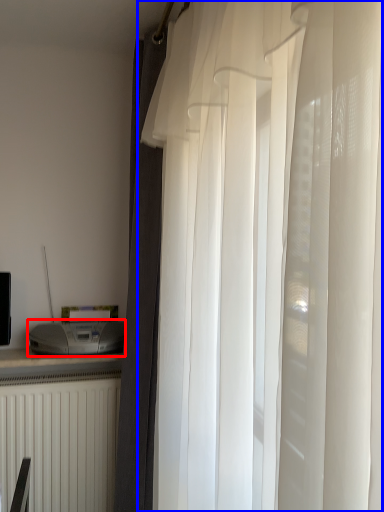
Question: Which point is further to the camera, appliance (highlighted by a red box) or curtain (highlighted by a blue box)?

Choices:
 (A) appliance
 (B) curtain

Answer: (A)